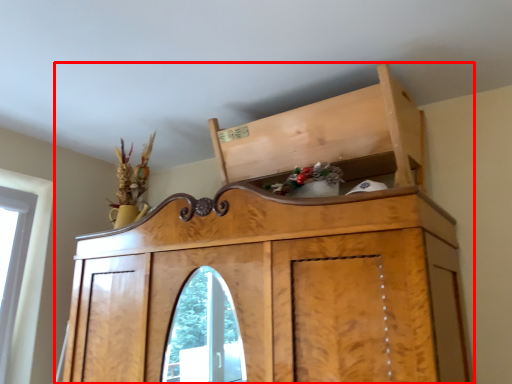
Question: From the image's perspective, where is furniture (annotated by the red box) located in relation to cabinetry in the image?

Choices:
 (A) above
 (B) below

Answer: (B)